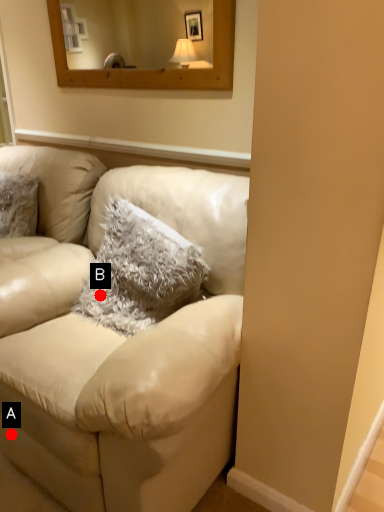
Question: Two points are circled on the image, labeled by A and B beside each circle. Which of the following is the closest to the observer?

Choices:
 (A) A is closer
 (B) B is closer

Answer: (A)